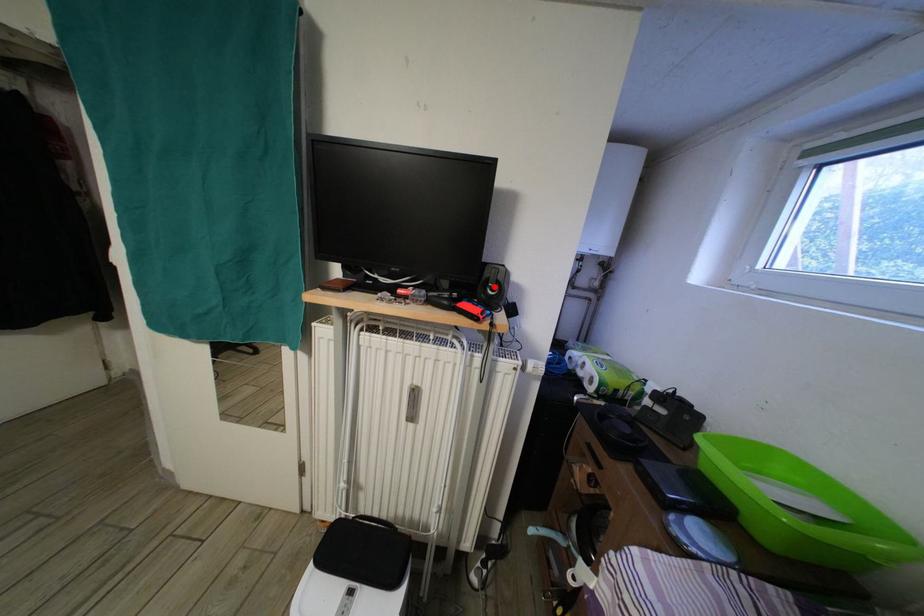
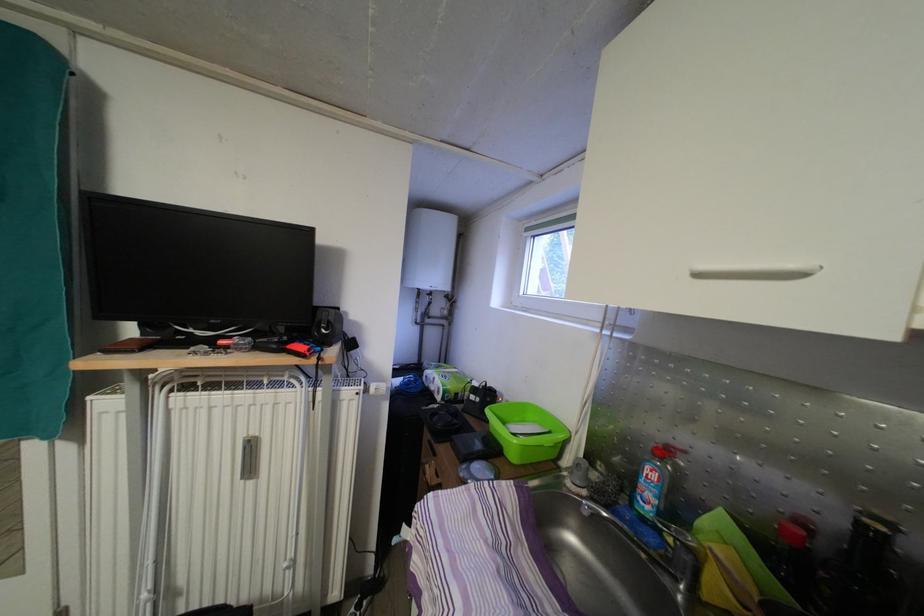
Where in the second image is the point corresponding to the highlighted location from the first image?

(326, 329)